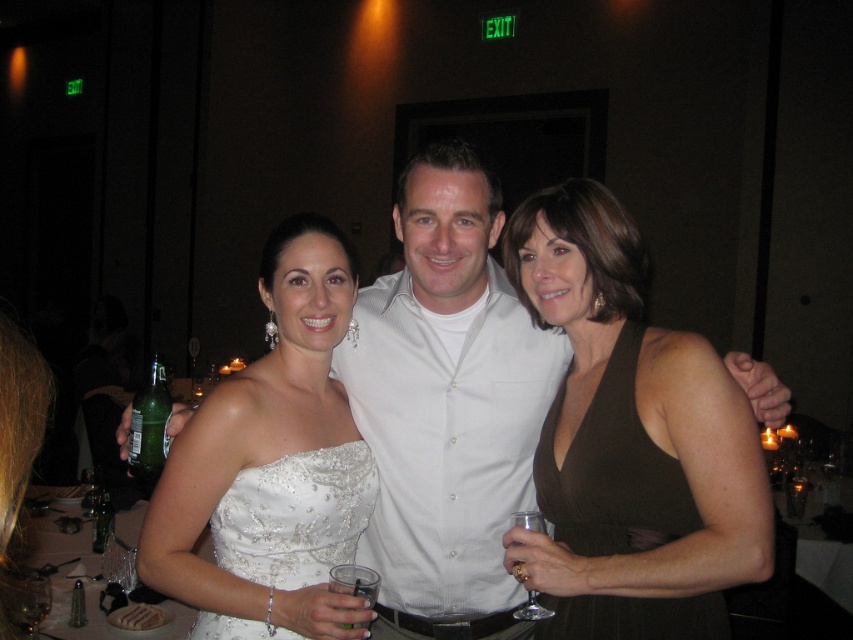
Based on the scene description and the coordinates provided, what object is located at the point with coordinates (440,378)?

The point at coordinates (440,378) indicates the white satin dress at center.

You are a photographer at a wedding reception. You need to position two bridesmaids in front of a backdrop. The bridesmaids are wearing the white satin dress at center and the satin white dress at center. Which bridesmaid should stand behind the other to ensure both are visible in the photo?

The white satin dress at center is taller than the satin white dress at center, so the shorter satin white dress at center should be placed in front to ensure both are visible.